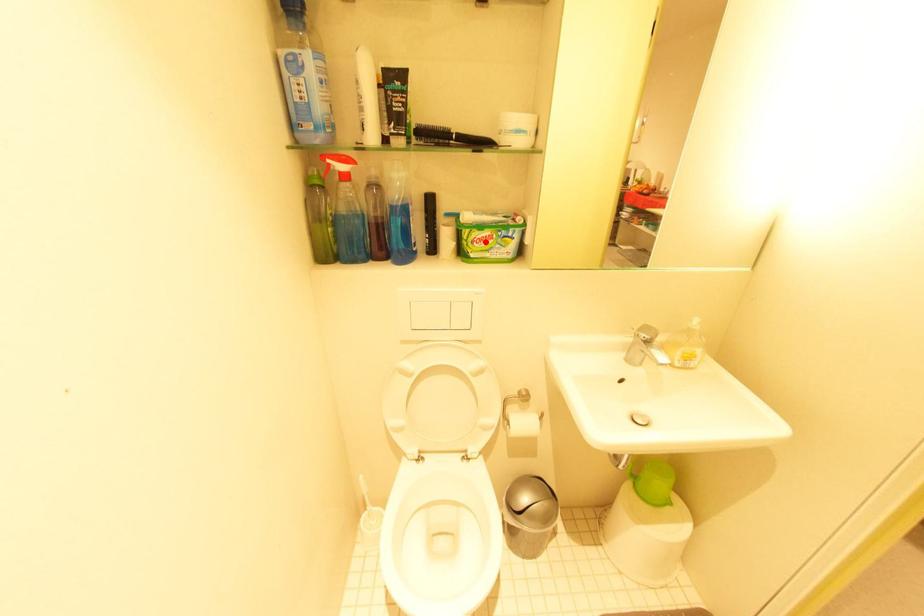
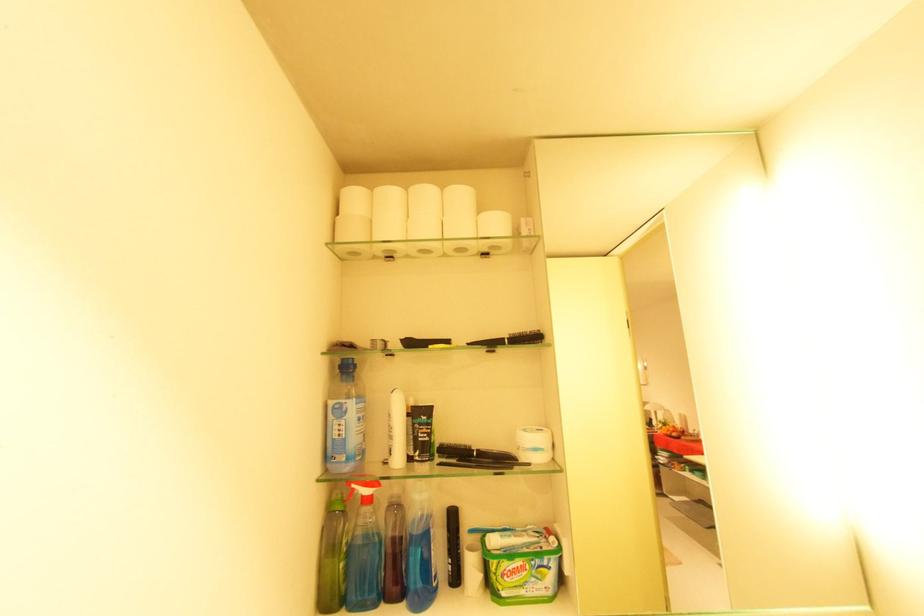
Question: I am providing you with two images of the same scene from different viewpoints. A red point is marked on the first image. Can you still see the location of the red point in image 2?

Choices:
 (A) Yes
 (B) No

Answer: (A)